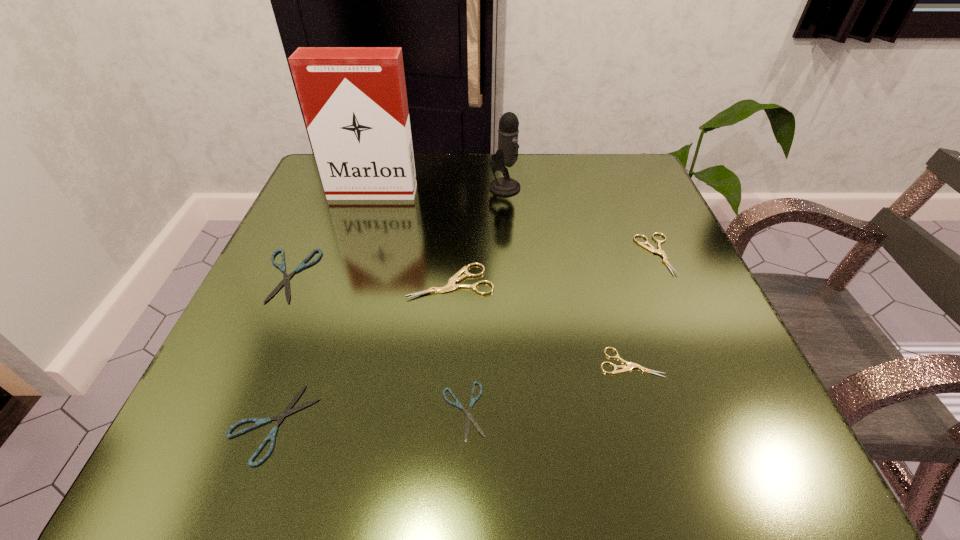
Locate an element on the screen. This screenshot has height=540, width=960. red cigarette_case is located at coordinates (354, 101).

Find the location of a particular element. Image resolution: width=960 pixels, height=540 pixels. cigarette_case is located at coordinates (354, 101).

I want to click on microphone, so click(507, 154).

Locate an element on the screen. This screenshot has width=960, height=540. the second tallest object is located at coordinates (507, 154).

At what (x,y) coordinates should I click in order to perform the action: click on the tallest shears. Please return your answer as a coordinate pair (x, y). This screenshot has height=540, width=960. Looking at the image, I should click on (450, 286).

Find the location of a particular element. This screenshot has height=540, width=960. the biggest beige shears is located at coordinates pyautogui.click(x=450, y=286).

This screenshot has width=960, height=540. I want to click on the rightmost shears, so click(651, 248).

Find the location of a particular element. the rightmost beige shears is located at coordinates (651, 248).

This screenshot has height=540, width=960. In order to click on the biggest black shears in this screenshot , I will do `click(302, 265)`.

I want to click on the sixth farthest object, so click(630, 365).